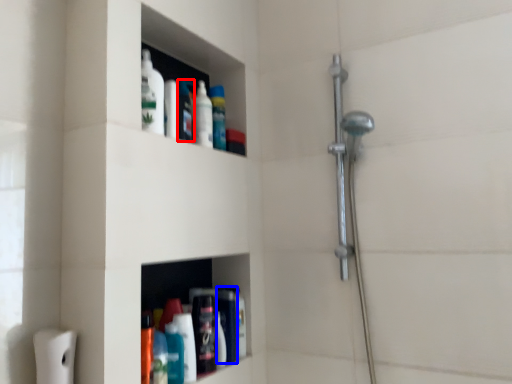
Question: Which object is further to the camera taking this photo, toiletry (highlighted by a red box) or toiletry (highlighted by a blue box)?

Choices:
 (A) toiletry
 (B) toiletry

Answer: (B)